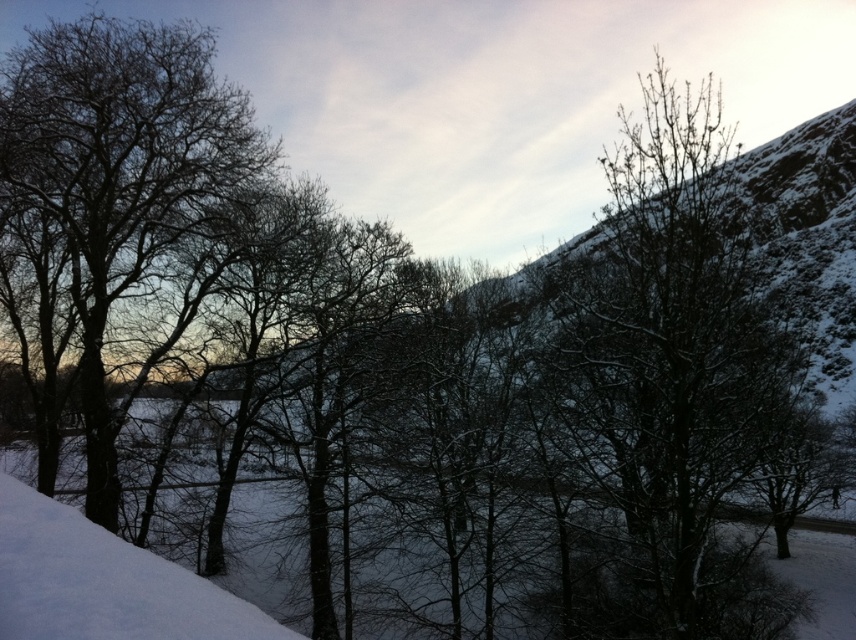
You are standing in the winter landscape shown in the image. There is a point marked at coordinates [672,376]. What object is located at that point?

The point at coordinates [672,376] indicates a snow covered tree at center.